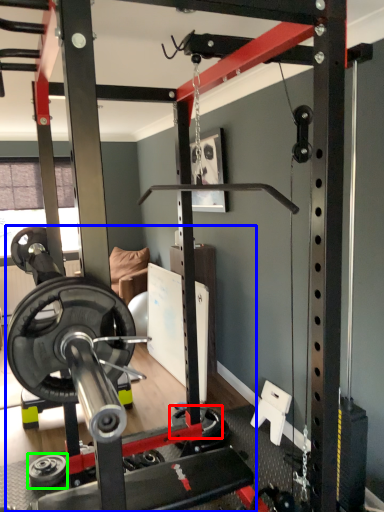
Question: Which object is positioned farthest from wheel (highlighted by a red box)? Select from barbell (highlighted by a blue box) and wheel (highlighted by a green box).

Choices:
 (A) barbell
 (B) wheel

Answer: (B)